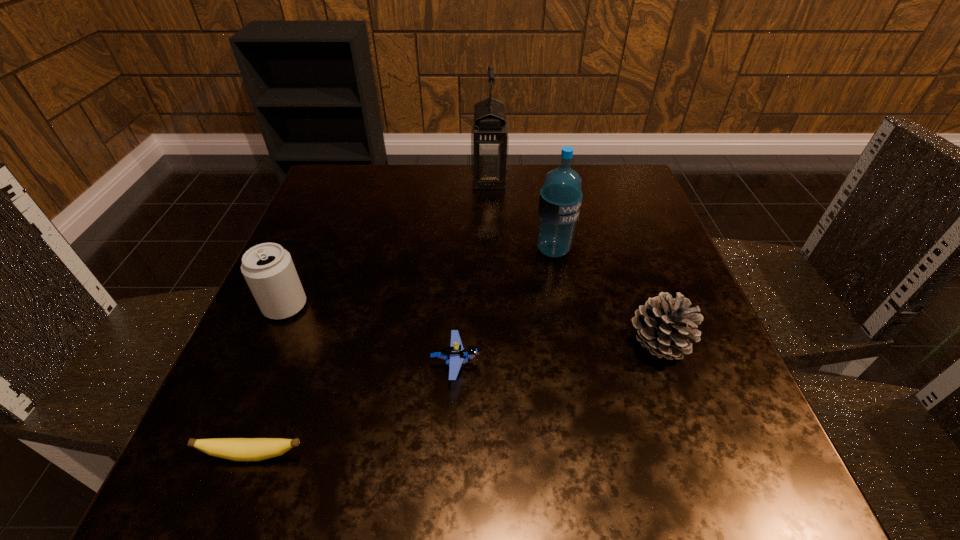
Identify which object is located as the nearest to the fifth tallest object. Please provide its 2D coordinates. Your answer should be formatted as a tuple, i.e. [(x, y)], where the tuple contains the x and y coordinates of a point satisfying the conditions above.

[(237, 449)]

The width and height of the screenshot is (960, 540). Identify the location of object that is the third closest to the lantern. coord(663,324).

The image size is (960, 540). In order to click on vacant space that satisfies the following two spatial constraints: 1. on the front-facing side of the farthest object; 2. on the front side of the can in this screenshot , I will do `click(492, 306)`.

This screenshot has width=960, height=540. Identify the location of free space that satisfies the following two spatial constraints: 1. on the front-facing side of the second shortest object; 2. on the front side of the nearest object. (451, 455).

You are a GUI agent. You are given a task and a screenshot of the screen. Output one action in this format:
    pyautogui.click(x=<x>, y=<y>)
    Task: Click on the free space that satisfies the following two spatial constraints: 1. on the front-facing side of the fifth object from left to right; 2. on the right side of the farthest object
    The height and width of the screenshot is (540, 960).
    Given the screenshot: What is the action you would take?
    pyautogui.click(x=492, y=250)

Locate an element on the screen. Image resolution: width=960 pixels, height=540 pixels. free space that satisfies the following two spatial constraints: 1. on the front-facing side of the farthest object; 2. on the right side of the fifth nearest object is located at coordinates (492, 250).

Locate an element on the screen. The image size is (960, 540). vacant space that satisfies the following two spatial constraints: 1. on the front-facing side of the lantern; 2. on the left side of the fifth object from left to right is located at coordinates (492, 250).

Identify the location of vacant position in the image that satisfies the following two spatial constraints: 1. on the front-facing side of the rightmost object; 2. on the right side of the farthest object. This screenshot has height=540, width=960. (493, 344).